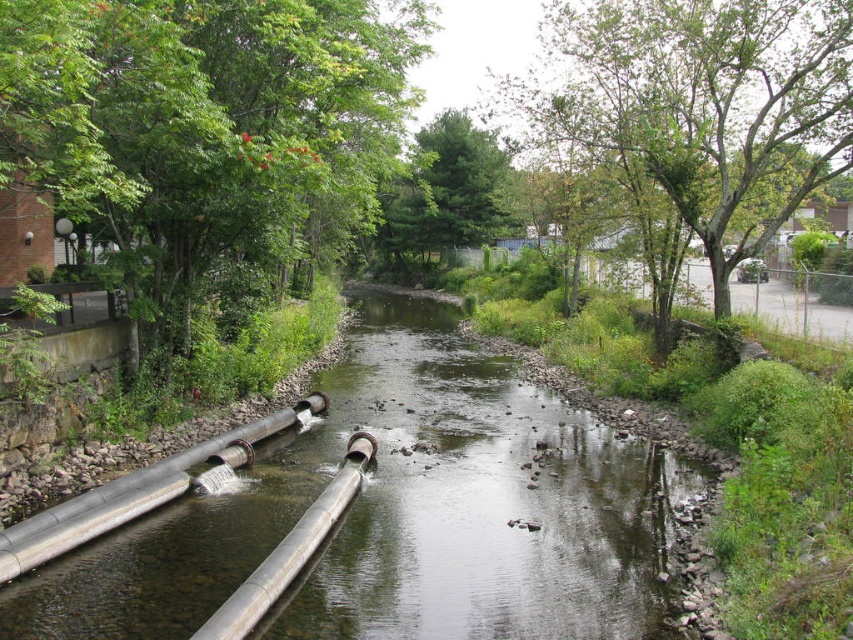
Is gray rubber water pipe at center-left wider than silver metallic pipe at center?

Incorrect, gray rubber water pipe at center-left's width does not surpass silver metallic pipe at center's.

Does gray rubber water pipe at center-left appear on the left side of silver metallic pipe at center?

Correct, you'll find gray rubber water pipe at center-left to the left of silver metallic pipe at center.

Image resolution: width=853 pixels, height=640 pixels. What do you see at coordinates (136, 492) in the screenshot?
I see `gray rubber water pipe at center-left` at bounding box center [136, 492].

Where is `gray rubber water pipe at center-left`? This screenshot has height=640, width=853. gray rubber water pipe at center-left is located at coordinates (136, 492).

Is green leafy tree at upper left behind green matte tree at center?

No.

Describe the element at coordinates (207, 138) in the screenshot. This screenshot has width=853, height=640. I see `green leafy tree at upper left` at that location.

Is point (6, 49) closer to viewer compared to point (474, 186)?

Yes, point (6, 49) is closer to viewer.

At what (x,y) coordinates should I click in order to perform the action: click on green leafy tree at upper left. Please return your answer as a coordinate pair (x, y). Looking at the image, I should click on (207, 138).

Is green leafy tree at upper left behind green leafy tree at upper right?

No, it is in front of green leafy tree at upper right.

Is green leafy tree at upper left shorter than green leafy tree at upper right?

Indeed, green leafy tree at upper left has a lesser height compared to green leafy tree at upper right.

What do you see at coordinates (207, 138) in the screenshot? The height and width of the screenshot is (640, 853). I see `green leafy tree at upper left` at bounding box center [207, 138].

Locate an element on the screen. green leafy tree at upper left is located at coordinates (207, 138).